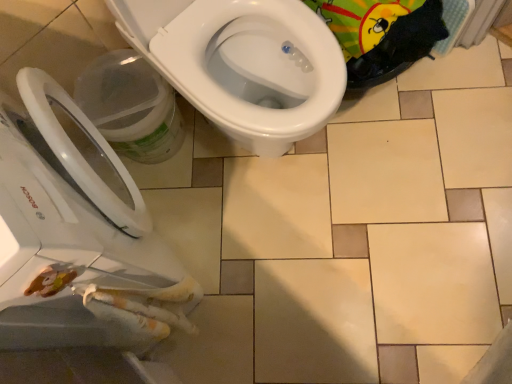
What is the approximate width of transparent plastic bucket at lower left?

The width of transparent plastic bucket at lower left is 9.21 inches.

In order to face white glossy bidet at center, should I rotate leftwards or rightwards?

It's best to rotate left around 3.313 degrees.

The image size is (512, 384). Find the location of `white glossy toilet at upper center`. white glossy toilet at upper center is located at coordinates (79, 238).

Is white glossy bidet at center far from transparent plastic bucket at lower left?

No, white glossy bidet at center is not far from transparent plastic bucket at lower left.

Consider the image. Who is taller, white glossy bidet at center or transparent plastic bucket at lower left?

white glossy bidet at center is taller.

From a real-world perspective, is white glossy bidet at center positioned above or below transparent plastic bucket at lower left?

white glossy bidet at center is situated higher than transparent plastic bucket at lower left in the real world.

Considering the sizes of objects white glossy bidet at center and transparent plastic bucket at lower left in the image provided, who is thinner, white glossy bidet at center or transparent plastic bucket at lower left?

transparent plastic bucket at lower left is thinner.

Can you tell me how much white glossy bidet at center and white glossy toilet at upper center differ in facing direction?

The facing directions of white glossy bidet at center and white glossy toilet at upper center are 90 degrees apart.

Is white glossy bidet at center thinner than white glossy toilet at upper center?

Correct, the width of white glossy bidet at center is less than that of white glossy toilet at upper center.

Is white glossy bidet at center facing towards white glossy toilet at upper center?

No, white glossy bidet at center is not turned towards white glossy toilet at upper center.

Is white glossy toilet at upper center surrounded by white glossy bidet at center?

Definitely not — white glossy toilet at upper center is not inside white glossy bidet at center.

Is the surface of white glossy toilet at upper center in direct contact with white glossy bidet at center?

No, white glossy toilet at upper center is not next to white glossy bidet at center.

From a real-world perspective, is white glossy toilet at upper center over white glossy bidet at center?

Yes.

Is white glossy toilet at upper center behind white glossy bidet at center?

No, white glossy toilet at upper center is closer to the viewer.

Considering the positions of objects transparent plastic bucket at lower left and white glossy toilet at upper center in the image provided, who is in front, transparent plastic bucket at lower left or white glossy toilet at upper center?

white glossy toilet at upper center is more forward.

In the scene shown: From a real-world perspective, who is located higher, transparent plastic bucket at lower left or white glossy toilet at upper center?

white glossy toilet at upper center, from a real-world perspective.

Is white glossy toilet at upper center in front of or behind transparent plastic bucket at lower left in the image?

white glossy toilet at upper center is in front of transparent plastic bucket at lower left.

Is white glossy toilet at upper center located outside transparent plastic bucket at lower left?

white glossy toilet at upper center lies outside transparent plastic bucket at lower left's area.

Is white glossy toilet at upper center oriented towards transparent plastic bucket at lower left?

Yes, white glossy toilet at upper center is aimed at transparent plastic bucket at lower left.

Who is bigger, transparent plastic bucket at lower left or white glossy bidet at center?

white glossy bidet at center is bigger.

Relative to white glossy bidet at center, is transparent plastic bucket at lower left in front or behind?

transparent plastic bucket at lower left is positioned farther from the viewer than white glossy bidet at center.

From the image's perspective, between transparent plastic bucket at lower left and white glossy bidet at center, which one is located above?

white glossy bidet at center appears higher in the image.

In the scene shown: Are transparent plastic bucket at lower left and white glossy bidet at center far apart?

No.

Identify the location of potty lying below the white glossy bidet at center (from the image's perspective). (131, 106).

This screenshot has width=512, height=384. In order to click on bidet on the right of the white glossy toilet at upper center in this screenshot , I will do `click(256, 68)`.

Estimate the real-world distances between objects in this image. Which object is further from white glossy toilet at upper center, white glossy bidet at center or transparent plastic bucket at lower left?

white glossy bidet at center.

When comparing their distances from transparent plastic bucket at lower left, does white glossy bidet at center or white glossy toilet at upper center seem closer?

white glossy bidet at center.

Estimate the real-world distances between objects in this image. Which object is further from white glossy bidet at center, transparent plastic bucket at lower left or white glossy toilet at upper center?

white glossy toilet at upper center is positioned further to the anchor white glossy bidet at center.

When comparing their distances from transparent plastic bucket at lower left, does white glossy toilet at upper center or white glossy bidet at center seem further?

white glossy toilet at upper center is further to transparent plastic bucket at lower left.

Considering their positions, is transparent plastic bucket at lower left positioned further to white glossy toilet at upper center than white glossy bidet at center?

white glossy bidet at center is further to white glossy toilet at upper center.

Looking at the image, which one is located further to white glossy bidet at center, white glossy toilet at upper center or transparent plastic bucket at lower left?

The object further to white glossy bidet at center is white glossy toilet at upper center.

Locate an element on the screen. The image size is (512, 384). bidet between white glossy toilet at upper center and transparent plastic bucket at lower left in the front-back direction is located at coordinates (256, 68).